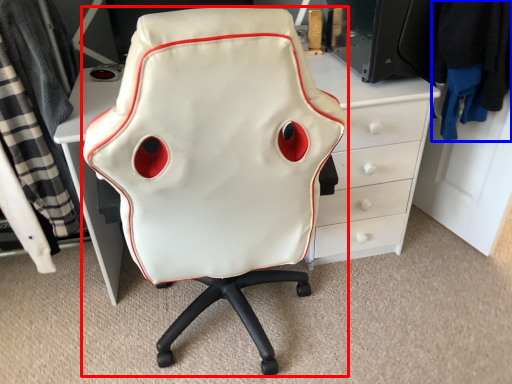
Question: Which of the following is the closest to the observer, chair (highlighted by a red box) or clothing (highlighted by a blue box)?

Choices:
 (A) chair
 (B) clothing

Answer: (A)